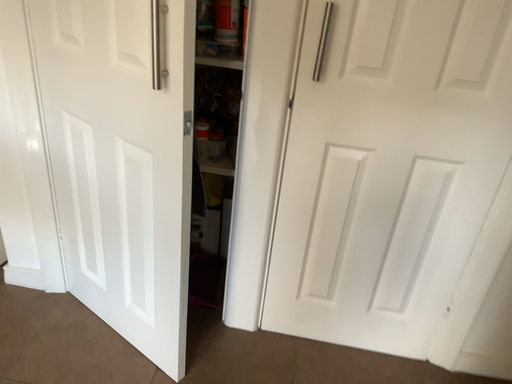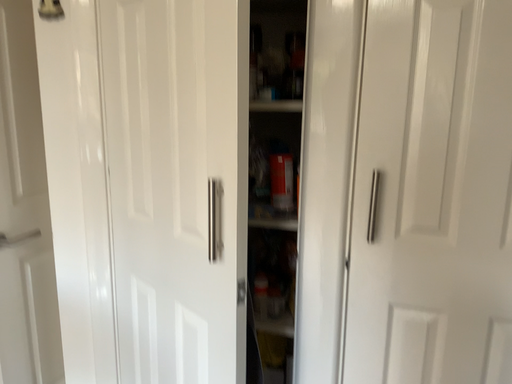
Question: Which way did the camera rotate in the video?

Choices:
 (A) rotated downward
 (B) rotated upward

Answer: (B)